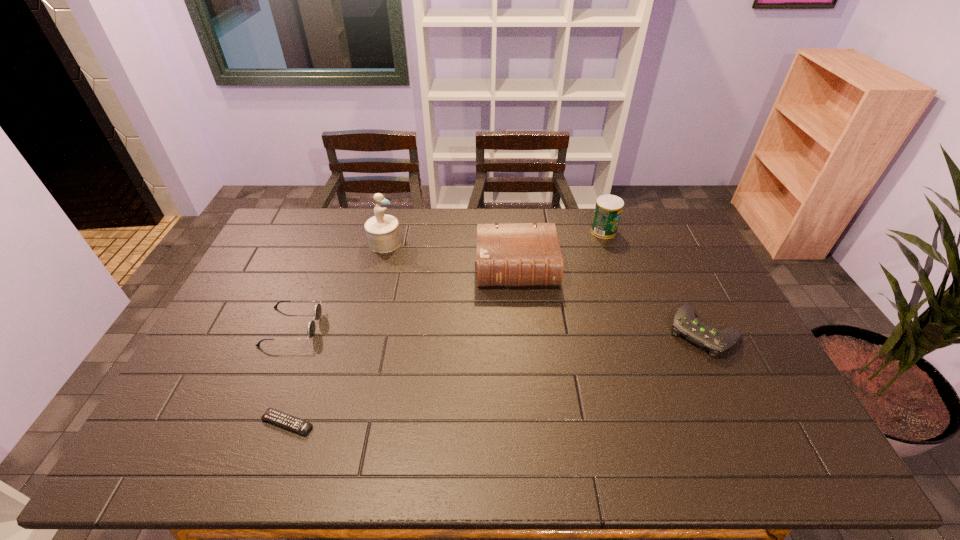
The height and width of the screenshot is (540, 960). Identify the location of free space located 0.130m on the spine side of the Bible. (521, 322).

At what (x,y) coordinates should I click in order to perform the action: click on free space located 0.250m on the front-facing side of the sunglasses. Please return your answer as a coordinate pair (x, y). The width and height of the screenshot is (960, 540). Looking at the image, I should click on (402, 327).

The height and width of the screenshot is (540, 960). What are the coordinates of `free space located 0.240m on the front of the rightmost object` in the screenshot? It's located at (756, 442).

Identify the location of vacant space located 0.340m on the right of the shortest object. (453, 423).

Locate an element on the screen. The height and width of the screenshot is (540, 960). figurine situated at the far edge is located at coordinates (383, 234).

You are a GUI agent. You are given a task and a screenshot of the screen. Output one action in this format:
    pyautogui.click(x=<x>, y=<y>)
    Task: Click on the can that is at the far edge
    The width and height of the screenshot is (960, 540).
    Given the screenshot: What is the action you would take?
    pyautogui.click(x=608, y=209)

The width and height of the screenshot is (960, 540). I want to click on object located in the near edge section of the desktop, so click(272, 415).

In order to click on object located at the left edge in this screenshot , I will do `click(311, 327)`.

The height and width of the screenshot is (540, 960). In order to click on object that is at the right edge in this screenshot , I will do `click(685, 324)`.

The width and height of the screenshot is (960, 540). What are the coordinates of `vacant space at the far edge of the desktop` in the screenshot? It's located at (324, 243).